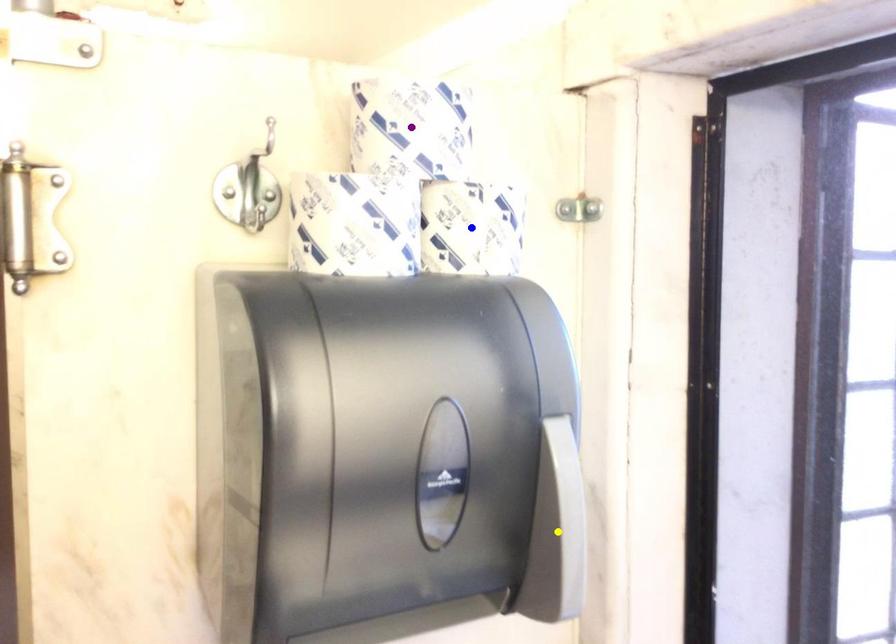
Order these from nearest to farthest:
1. blue point
2. purple point
3. yellow point

yellow point → purple point → blue point